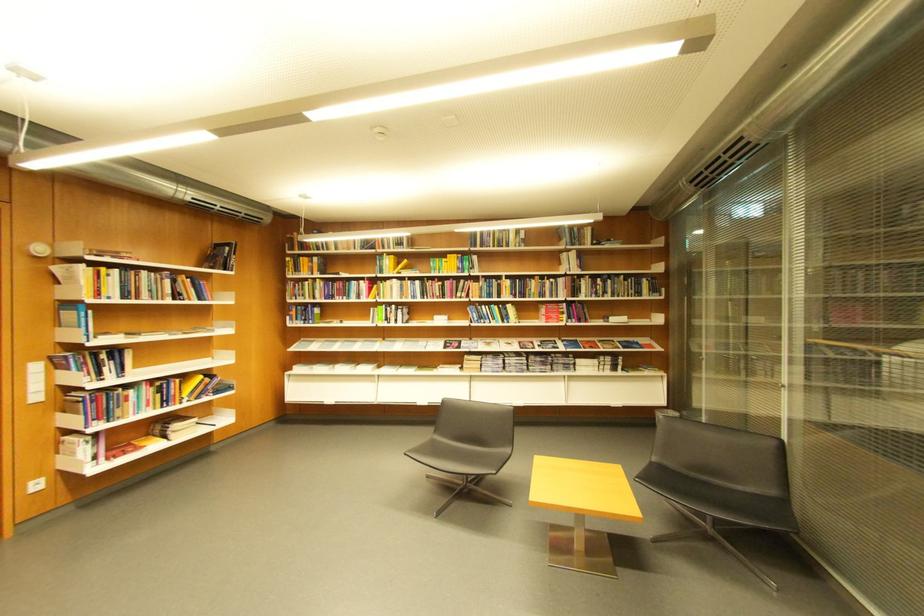
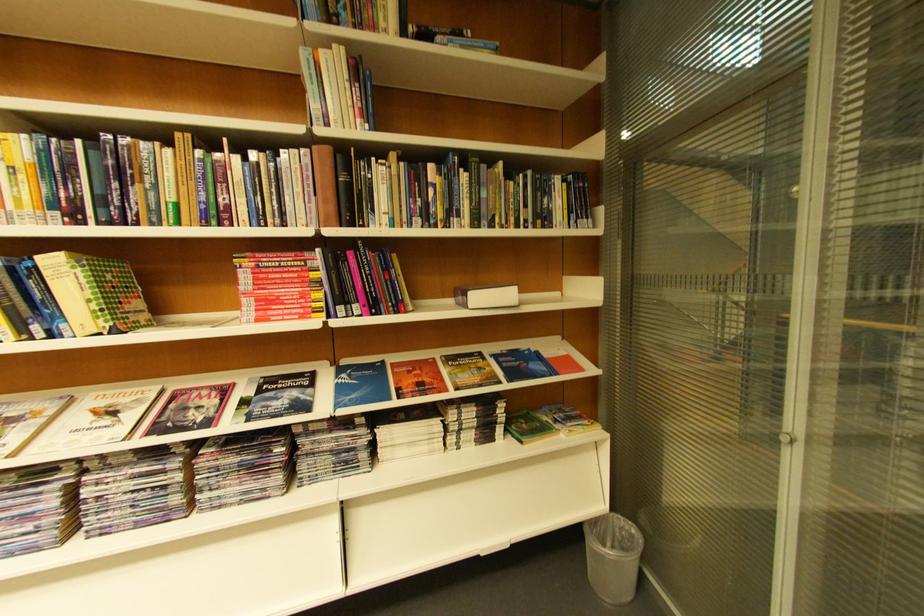
The point at (x=593, y=246) is marked in the first image. Where is the corresponding point in the second image?

(384, 31)